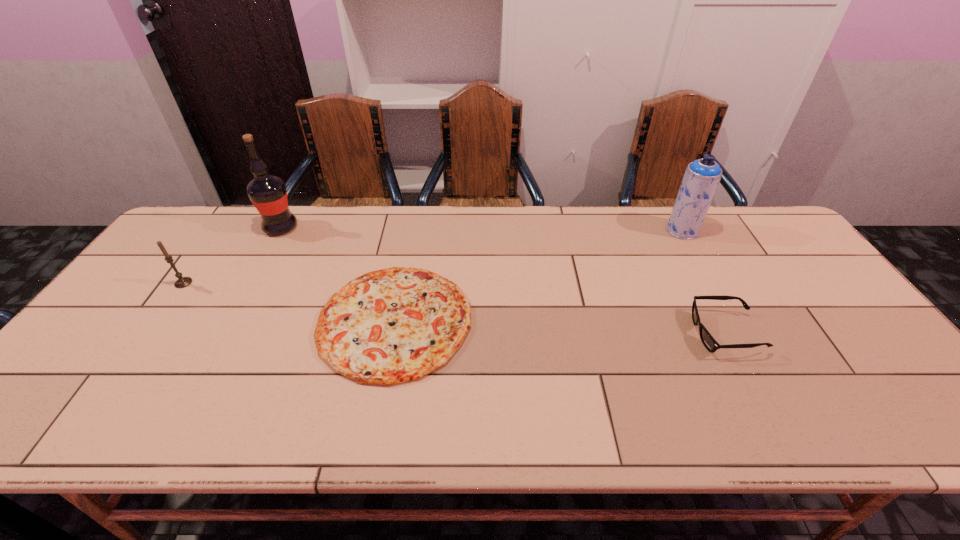
At what (x,y) coordinates should I click in order to perform the action: click on the second object from left to right. Please return your answer as a coordinate pair (x, y). Looking at the image, I should click on (267, 192).

Identify the location of wine bottle. (267, 192).

Identify the location of the second tallest object. (702, 176).

Where is `the leftmost object`? Image resolution: width=960 pixels, height=540 pixels. the leftmost object is located at coordinates (x=182, y=282).

Where is `candle`? The height and width of the screenshot is (540, 960). candle is located at coordinates (182, 282).

Identify the location of the second shortest object. (709, 342).

This screenshot has height=540, width=960. In order to click on pizza in this screenshot , I will do `click(398, 324)`.

Locate an element on the screen. The height and width of the screenshot is (540, 960). the shortest object is located at coordinates (398, 324).

At what (x,y) coordinates should I click in order to perform the action: click on vacant point located 0.340m on the front of the second object from left to right. Please return your answer as a coordinate pair (x, y). Looking at the image, I should click on (231, 318).

Image resolution: width=960 pixels, height=540 pixels. In order to click on free region located on the right of the second tallest object in this screenshot , I will do `click(716, 231)`.